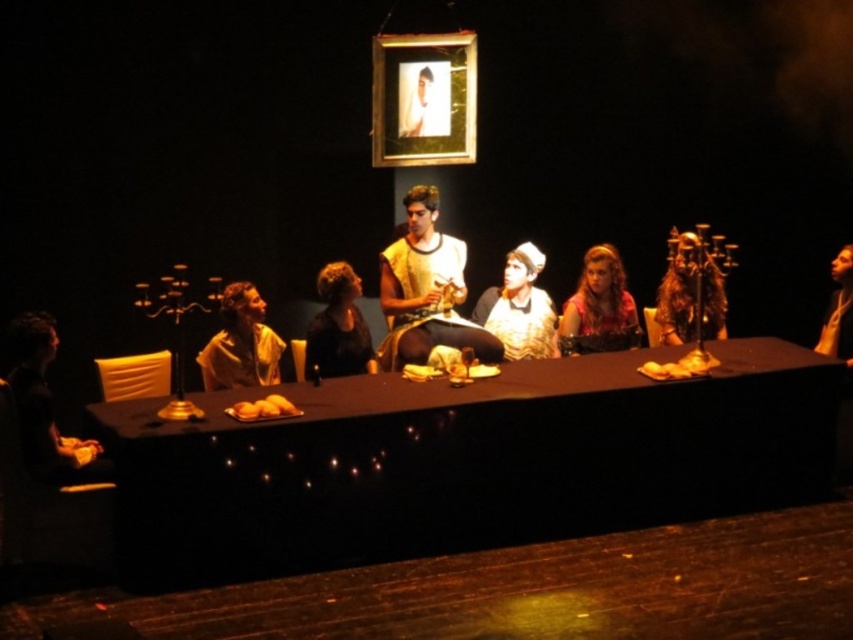
You are a stagehand who needs to place a small decorative item on the table. The item requires a spot that is elevated enough to be seen from the audience. Based on the scene, which object between the gold textured fabric at center and the yellow matte bread at center would you choose to place the item on top of?

The gold textured fabric at center is much taller than the yellow matte bread at center, so placing the item on top of the gold textured fabric at center would make it more visible to the audience.

You are a stagehand tasked with placing a new prop on the table in the center of the stage. The prop must be placed below the gold fabric robe at center. Where should you place the prop in relation to the yellow matte bread at center?

The gold fabric robe at center is above the yellow matte bread at center, so placing the prop below the gold fabric robe at center would mean placing it directly on or near the yellow matte bread at center.